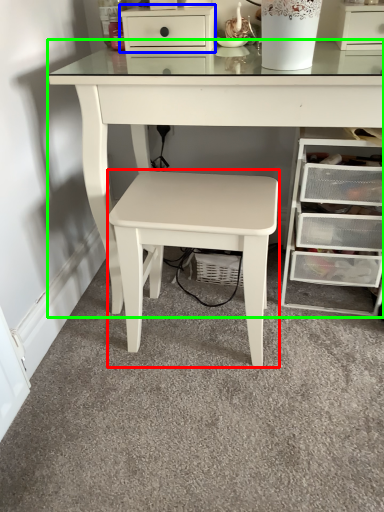
Question: Estimate the real-world distances between objects in this image. Which object is farther from stool (highlighted by a red box), chest of drawers (highlighted by a blue box) or table (highlighted by a green box)?

Choices:
 (A) chest of drawers
 (B) table

Answer: (A)